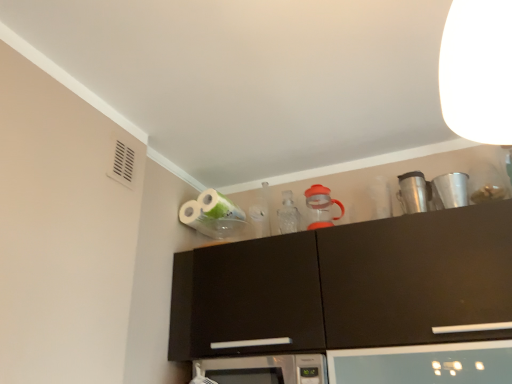
Question: Is point (207, 198) positioned closer to the camera than point (198, 374)?

Choices:
 (A) closer
 (B) farther

Answer: (B)

Question: Looking at the image, does white glossy toilet paper at upper center seem bigger or smaller compared to silver metallic microwave at center?

Choices:
 (A) small
 (B) big

Answer: (A)

Question: Estimate the real-world distances between objects in this image. Which object is farther from the metallic silver cup at upper right, acting as the third appliance starting from the left?

Choices:
 (A) orange plastic pitcher at upper center, which is the first appliance in left-to-right order
 (B) white glossy toilet paper at upper center
 (C) shiny metallic coffee cup at upper right, the 2th appliance in the left-to-right sequence
 (D) silver metallic microwave at center

Answer: (B)

Question: Estimate the real-world distances between objects in this image. Which object is farther from the white glossy toilet paper at upper center?

Choices:
 (A) metallic silver cup at upper right, acting as the third appliance starting from the left
 (B) orange plastic pitcher at upper center, which is the first appliance in left-to-right order
 (C) silver metallic microwave at center
 (D) shiny metallic coffee cup at upper right, the 2th appliance in the left-to-right sequence

Answer: (A)